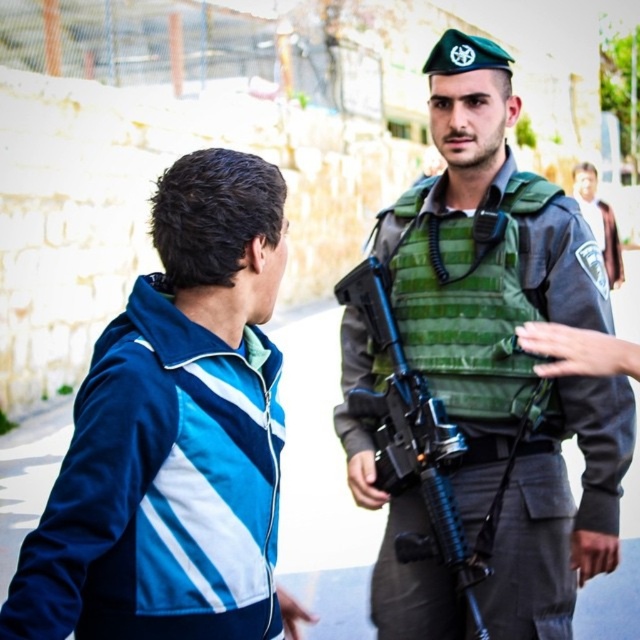
You are a drone operator trying to identify objects in an urban scene. You have coordinates for a point in the image. Can you determine what object is located at point [483,262]?

The point at [483,262] marks the green fabric vest at center.

You are a delivery drone that can carry packages up to 15 feet in length. You need to fly between the blue fabric jacket at upper left and the green uniform at center. Will your drone be able to fit through the space between them?

The distance between the blue fabric jacket at upper left and the green uniform at center is 14.56 feet, which is less than the drone maximum length of 15 feet. Therefore, the drone can safely navigate through the space between them.